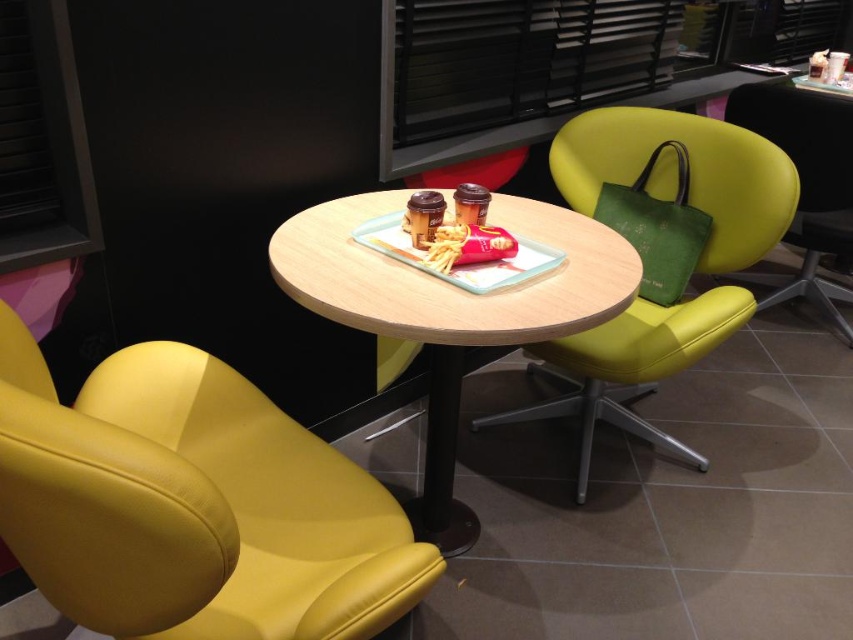
You are a customer entering the modern minimalist cafe and want to sit down at the wooden round table at center. There is a matte yellow swivel chair at center nearby. Considering their heights, which one do you think you should adjust first to sit comfortably?

The matte yellow swivel chair at center is taller than the wooden round table at center. To sit comfortably, you should lower the height of the matte yellow swivel chair at center first.

You are a customer entering the minimalist cafe and want to sit down. You see the yellow leather swivel chair at lower left and the wooden round table at center. Which object is bigger in size?

The yellow leather swivel chair at lower left is larger in size compared to the wooden round table at center according to the description.